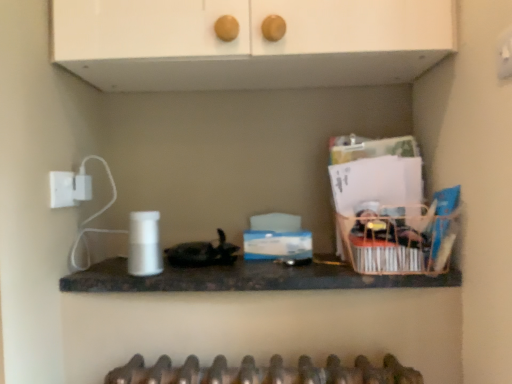
Question: Is wooden basket at right taller than white matte cabinet at upper center?

Choices:
 (A) yes
 (B) no

Answer: (B)

Question: Does wooden basket at right have a smaller size compared to white matte cabinet at upper center?

Choices:
 (A) yes
 (B) no

Answer: (A)

Question: Is wooden basket at right oriented away from white matte cabinet at upper center?

Choices:
 (A) yes
 (B) no

Answer: (B)

Question: Is wooden basket at right touching white matte cabinet at upper center?

Choices:
 (A) no
 (B) yes

Answer: (A)

Question: Is wooden basket at right far from white matte cabinet at upper center?

Choices:
 (A) no
 (B) yes

Answer: (A)

Question: Which is correct: wooden basket at right is inside black marble countertop at center, or outside of it?

Choices:
 (A) inside
 (B) outside

Answer: (B)

Question: Looking at the image, does wooden basket at right seem bigger or smaller compared to black marble countertop at center?

Choices:
 (A) small
 (B) big

Answer: (A)

Question: From a real-world perspective, is wooden basket at right physically located above or below black marble countertop at center?

Choices:
 (A) above
 (B) below

Answer: (A)

Question: Is wooden basket at right taller or shorter than black marble countertop at center?

Choices:
 (A) tall
 (B) short

Answer: (A)

Question: Choose the correct answer: Is white matte cabinet at upper center inside black marble countertop at center or outside it?

Choices:
 (A) inside
 (B) outside

Answer: (B)

Question: Is point (123, 41) closer or farther from the camera than point (159, 284)?

Choices:
 (A) closer
 (B) farther

Answer: (A)

Question: Would you say white matte cabinet at upper center is to the left or to the right of black marble countertop at center in the picture?

Choices:
 (A) left
 (B) right

Answer: (A)

Question: In terms of width, does white matte cabinet at upper center look wider or thinner when compared to black marble countertop at center?

Choices:
 (A) wide
 (B) thin

Answer: (A)

Question: In the image, is white matte cabinet at upper center positioned in front of or behind wooden basket at right?

Choices:
 (A) front
 (B) behind

Answer: (A)

Question: Visually, is white matte cabinet at upper center positioned to the left or to the right of wooden basket at right?

Choices:
 (A) left
 (B) right

Answer: (A)